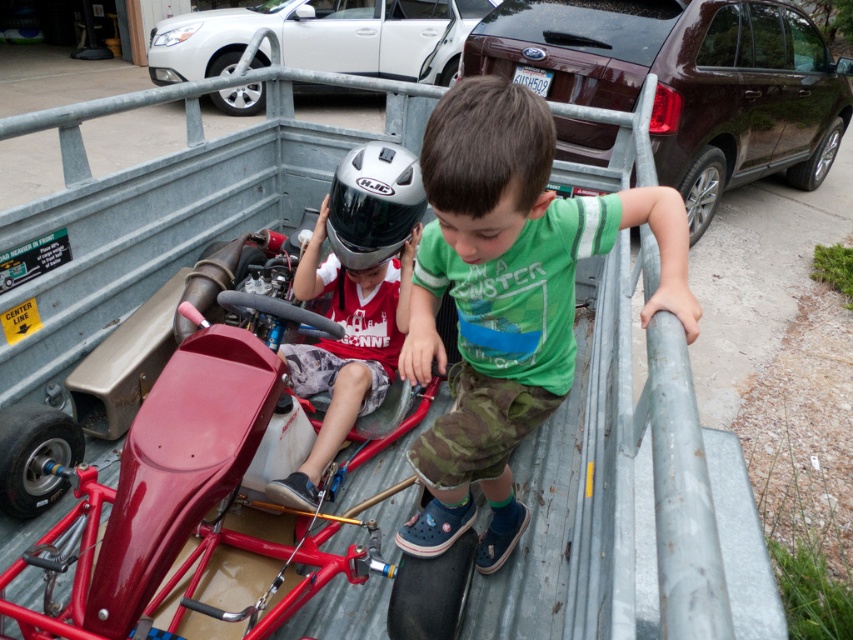
Who is lower down, green cotton shirt at center or silver metallic sedan at upper left?

Positioned lower is green cotton shirt at center.

Between green cotton shirt at center and silver metallic sedan at upper left, which one is positioned higher?

silver metallic sedan at upper left

Identify the location of green cotton shirt at center. The height and width of the screenshot is (640, 853). coord(508,298).

You are a GUI agent. You are given a task and a screenshot of the screen. Output one action in this format:
    pyautogui.click(x=<x>, y=<y>)
    Task: Click on the green cotton shirt at center
    
    Given the screenshot: What is the action you would take?
    pyautogui.click(x=508, y=298)

Who is positioned more to the left, silver metallic helmet at center or silver matte helmet at center?

Positioned to the left is silver metallic helmet at center.

Where is `silver metallic helmet at center`? silver metallic helmet at center is located at coordinates (354, 298).

This screenshot has width=853, height=640. What do you see at coordinates (354, 298) in the screenshot?
I see `silver metallic helmet at center` at bounding box center [354, 298].

At what (x,y) coordinates should I click in order to perform the action: click on silver metallic helmet at center. Please return your answer as a coordinate pair (x, y). The width and height of the screenshot is (853, 640). Looking at the image, I should click on (354, 298).

This screenshot has height=640, width=853. Identify the location of green cotton shirt at center. (508, 298).

Does green cotton shirt at center appear under silver matte helmet at center?

Yes.

Identify the location of green cotton shirt at center. (508, 298).